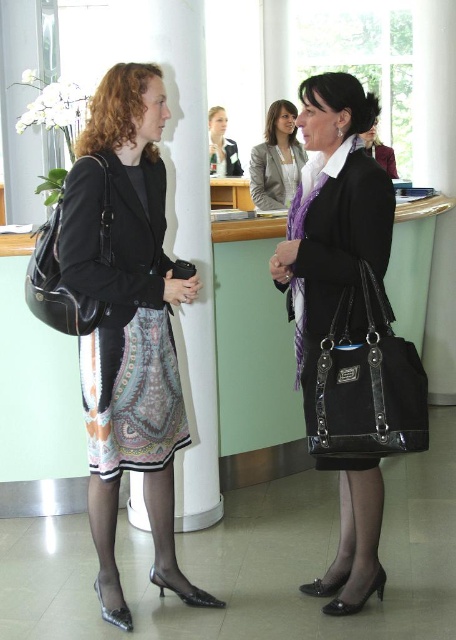
Looking at this image, who is higher up, matte black purse at left or printed silk dress at left?

Positioned higher is printed silk dress at left.

What are the coordinates of `matte black purse at left` in the screenshot? It's located at (128, 324).

At what (x,y) coordinates should I click in order to perform the action: click on matte black purse at left. Please return your answer as a coordinate pair (x, y). The height and width of the screenshot is (640, 456). Looking at the image, I should click on (128, 324).

Is point (346, 564) more distant than point (97, 205)?

Yes, it is.

Which is more to the left, matte black handbag at center or printed silk dress at left?

Positioned to the left is printed silk dress at left.

What do you see at coordinates (332, 212) in the screenshot? I see `matte black handbag at center` at bounding box center [332, 212].

Find the location of `matte black handbag at center`. matte black handbag at center is located at coordinates (332, 212).

Is point (103, 204) positioned in front of point (263, 209)?

Yes, point (103, 204) is closer to viewer.

Describe the element at coordinates (57, 284) in the screenshot. The height and width of the screenshot is (640, 456). I see `black leather handbag at left` at that location.

This screenshot has height=640, width=456. What are the coordinates of `black leather handbag at left` in the screenshot? It's located at (57, 284).